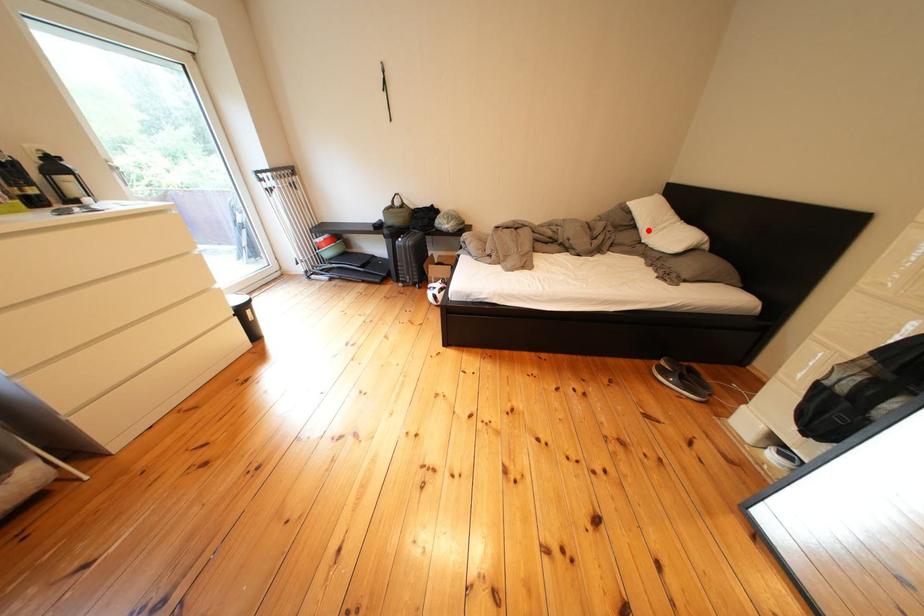
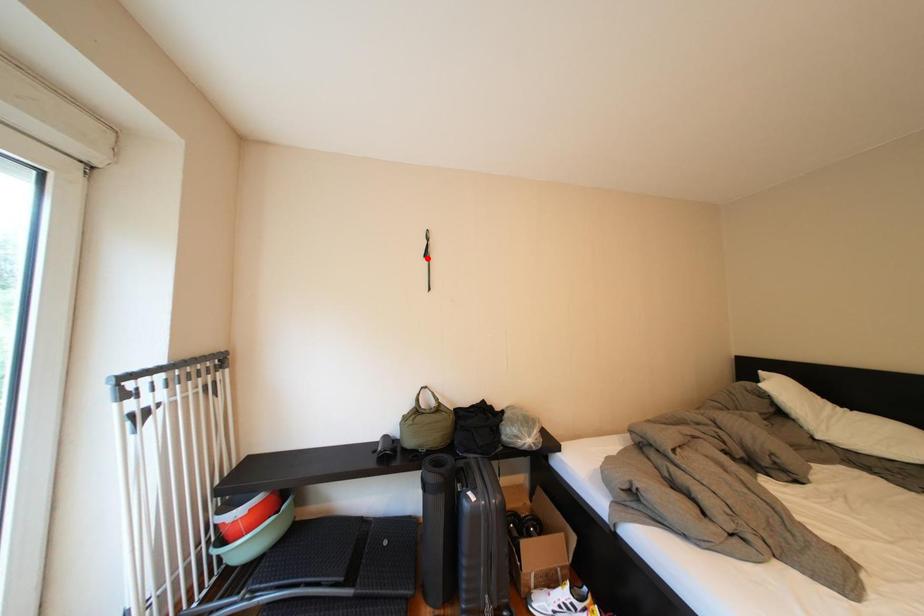
I am providing you with two images of the same scene from different viewpoints. A red point is marked on the first image and another point is marked on the second image. Does the point marked in image1 correspond to the same location as the one in image2?

No